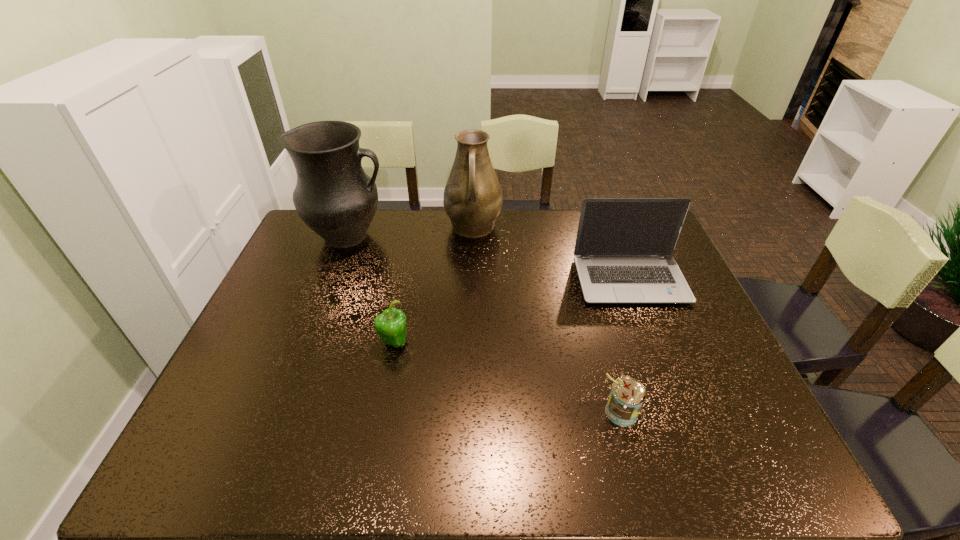
Point out which object is positioned as the second nearest to the right pitcher. Please provide its 2D coordinates. Your answer should be formatted as a tuple, i.e. [(x, y)], where the tuple contains the x and y coordinates of a point satisfying the conditions above.

[(623, 252)]

Identify which object is the third nearest to the third object from right to left. Please provide its 2D coordinates. Your answer should be formatted as a tuple, i.e. [(x, y)], where the tuple contains the x and y coordinates of a point satisfying the conditions above.

[(390, 325)]

This screenshot has width=960, height=540. Identify the location of free space that satisfies the following two spatial constraints: 1. on the handle side of the leftmost object; 2. on the right side of the can. (282, 411).

Where is `free location that satisfies the following two spatial constraints: 1. on the handle side of the third object from right to left; 2. on the handle side of the left pitcher`? This screenshot has height=540, width=960. free location that satisfies the following two spatial constraints: 1. on the handle side of the third object from right to left; 2. on the handle side of the left pitcher is located at coordinates (473, 236).

In order to click on vacant point that satisfies the following two spatial constraints: 1. on the handle side of the third object from right to left; 2. on the handle side of the leftmost object in this screenshot , I will do `click(473, 236)`.

Locate an element on the screen. The width and height of the screenshot is (960, 540). vacant space that satisfies the following two spatial constraints: 1. on the handle side of the third object from left to right; 2. on the left side of the can is located at coordinates (469, 411).

Image resolution: width=960 pixels, height=540 pixels. What are the coordinates of `vacant position in the image that satisfies the following two spatial constraints: 1. on the handle side of the can; 2. on the left side of the leftmost object` in the screenshot? It's located at (282, 411).